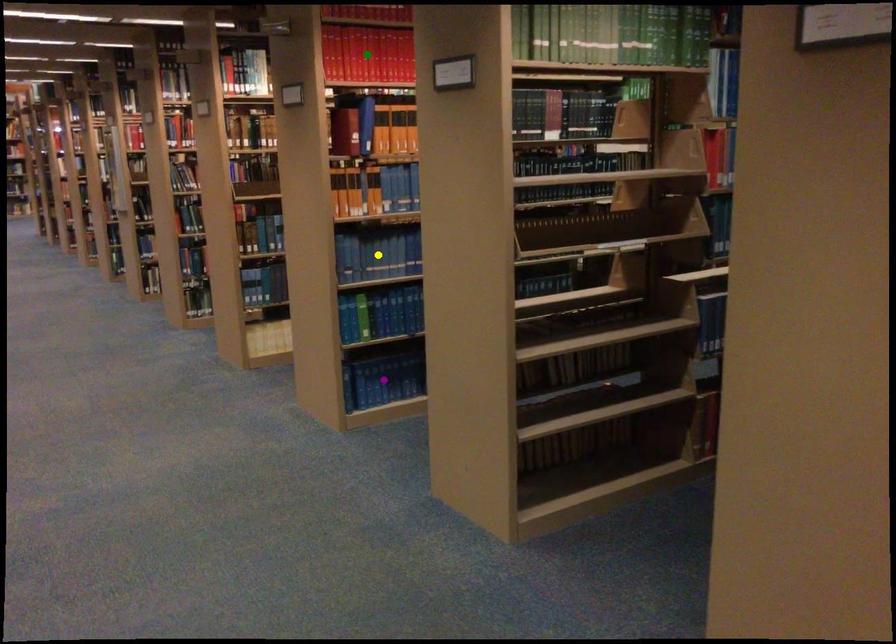
Order these from farthest to nearest:
green point, purple point, yellow point

purple point < yellow point < green point